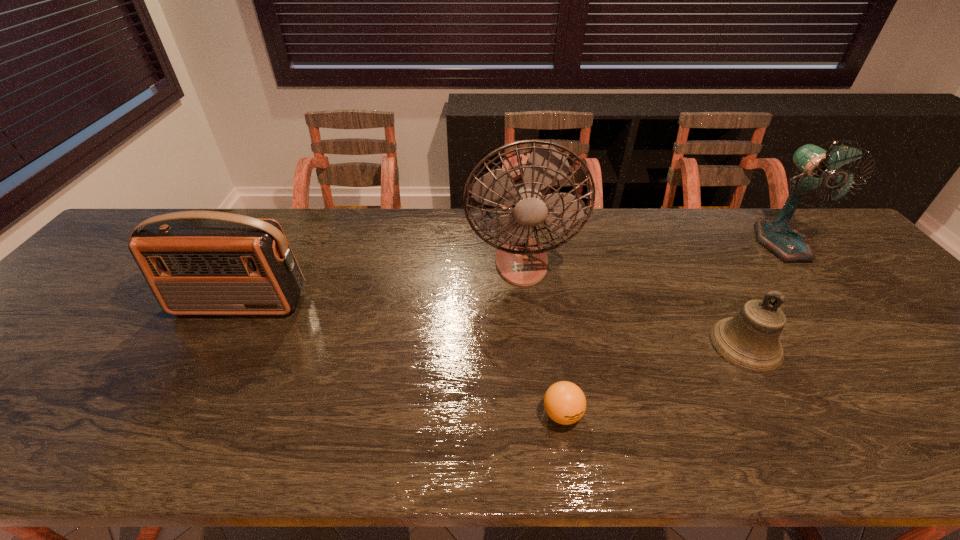
At what (x,y) coordinates should I click in order to perform the action: click on free space located in front of the right fan where the wind blows. Please return your answer as a coordinate pair (x, y). The width and height of the screenshot is (960, 540). Looking at the image, I should click on (820, 289).

Identify the location of vacant space located 0.100m on the front-facing side of the radio receiver. tap(213, 352).

Find the location of a particular element. vacant space located 0.290m on the right of the second object from right to left is located at coordinates (901, 345).

Locate an element on the screen. The height and width of the screenshot is (540, 960). object at the near edge is located at coordinates (565, 403).

What are the coordinates of `object at the right edge` in the screenshot? It's located at (818, 167).

Where is `object that is at the far right corner`? object that is at the far right corner is located at coordinates (818, 167).

Image resolution: width=960 pixels, height=540 pixels. Identify the location of free spot at the far edge of the desktop. pos(460,211).

The height and width of the screenshot is (540, 960). Identify the location of free space at the near edge of the desktop. (543, 434).

Where is `free space at the left edge of the desktop`? The width and height of the screenshot is (960, 540). free space at the left edge of the desktop is located at coordinates (45, 360).

At what (x,y) coordinates should I click in order to perform the action: click on free location at the right edge of the desktop. Please return your answer as a coordinate pair (x, y). This screenshot has width=960, height=540. Looking at the image, I should click on (896, 354).